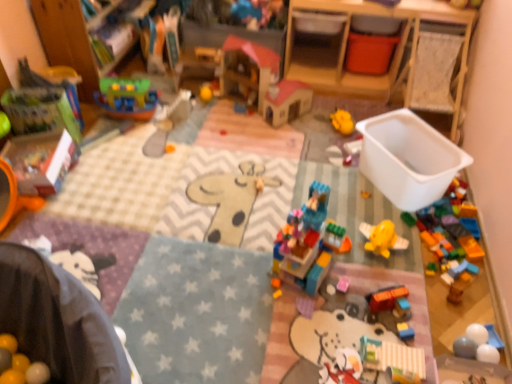
In order to click on unoccupied space behind translucent plastic castle at center, the 8th toy from the top in this screenshot , I will do `click(282, 221)`.